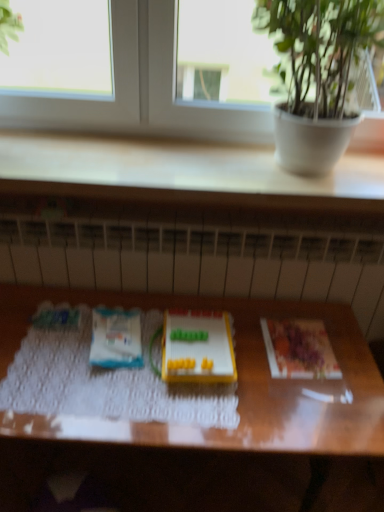
Find the location of `vacant point to the right of yellow plastic toy at center`. vacant point to the right of yellow plastic toy at center is located at coordinates (264, 362).